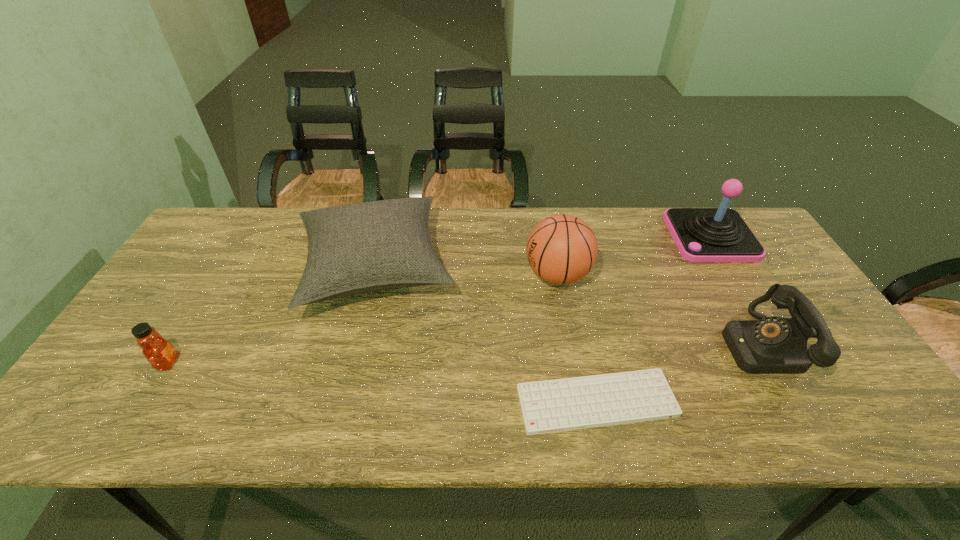
Identify which object is the fourth nearest to the telephone. Please provide its 2D coordinates. Your answer should be formatted as a tuple, i.e. [(x, y)], where the tuple contains the x and y coordinates of a point satisfying the conditions above.

[(358, 248)]

Where is `vacant region that satisfies the following two spatial constraints: 1. on the surface of the shortest object near the brand logo; 2. on the left side of the basketball`? The height and width of the screenshot is (540, 960). vacant region that satisfies the following two spatial constraints: 1. on the surface of the shortest object near the brand logo; 2. on the left side of the basketball is located at coordinates (581, 402).

The height and width of the screenshot is (540, 960). I want to click on vacant space that satisfies the following two spatial constraints: 1. on the back side of the shortest object; 2. on the surface of the basketball near the brand logo, so tap(569, 275).